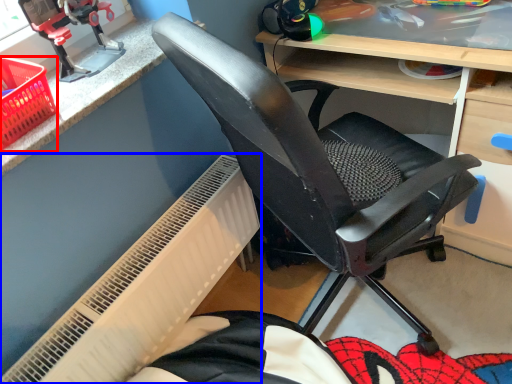
Question: Which of the following is the closest to the observer, basket (highlighted by a red box) or radiator (highlighted by a blue box)?

Choices:
 (A) basket
 (B) radiator

Answer: (A)